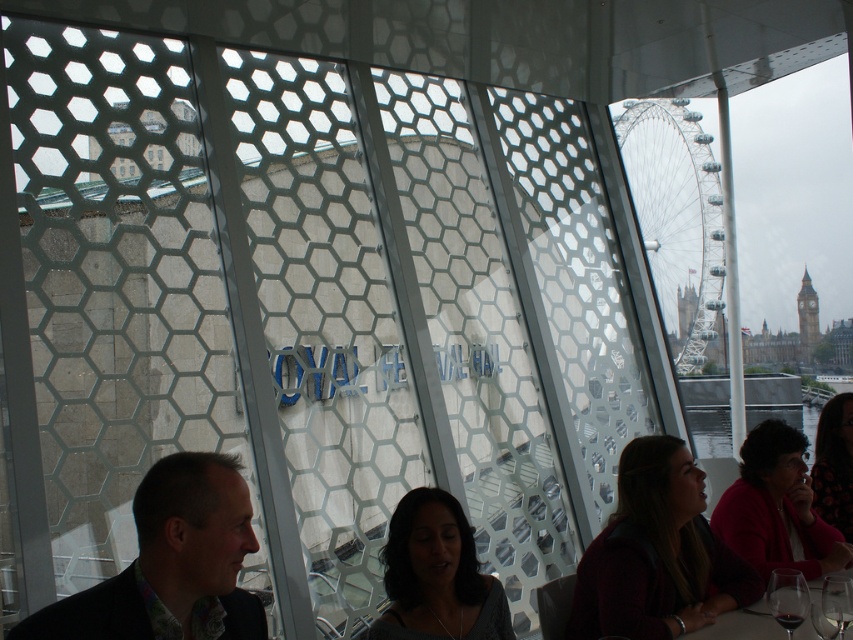
Between point (207, 532) and point (711, 557), which one is positioned in front?

Point (207, 532)

Does floral-patterned shirt at left have a lesser height compared to dark brown leather jacket at lower right?

Yes.

This screenshot has height=640, width=853. In order to click on floral-patterned shirt at left in this screenshot , I will do `click(171, 563)`.

What are the coordinates of `floral-patterned shirt at left` in the screenshot? It's located at (171, 563).

Is the position of transparent glass table at lower right less distant than that of transparent glass at lower right?

No.

Who is more forward, (846, 573) or (837, 600)?

A: Positioned in front is point (837, 600).

At what (x,y) coordinates should I click in order to perform the action: click on transparent glass table at lower right. Please return your answer as a coordinate pair (x, y). The height and width of the screenshot is (640, 853). Looking at the image, I should click on (741, 625).

Does matte pink sweater at lower right appear over transparent glass at lower right?

Correct, matte pink sweater at lower right is located above transparent glass at lower right.

Does matte pink sweater at lower right appear under transparent glass at lower right?

Actually, matte pink sweater at lower right is above transparent glass at lower right.

Where is `matte pink sweater at lower right`? matte pink sweater at lower right is located at coordinates (776, 508).